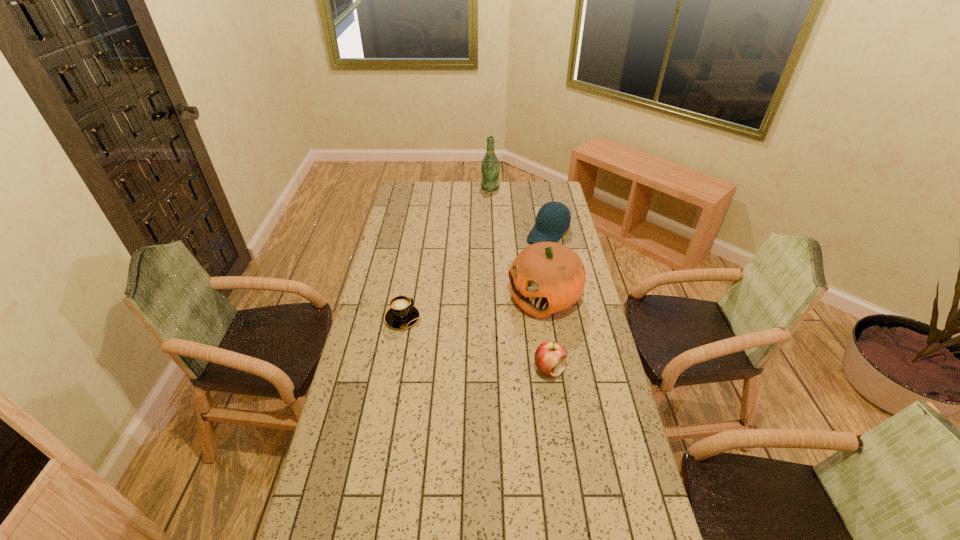
Find the location of a particular element. The width and height of the screenshot is (960, 540). object situated at the far edge is located at coordinates (490, 168).

Where is `object located in the left edge section of the desktop`? This screenshot has width=960, height=540. object located in the left edge section of the desktop is located at coordinates tap(402, 314).

Find the location of a particular element. The image size is (960, 540). apple present at the right edge is located at coordinates (550, 357).

Where is `pumpkin that is at the right edge`? The width and height of the screenshot is (960, 540). pumpkin that is at the right edge is located at coordinates (546, 277).

This screenshot has height=540, width=960. I want to click on baseball cap that is positioned at the right edge, so pos(553,219).

This screenshot has width=960, height=540. I want to click on free space at the far edge of the desktop, so click(533, 199).

Where is `blank space at the left edge`? The width and height of the screenshot is (960, 540). blank space at the left edge is located at coordinates (353, 434).

This screenshot has width=960, height=540. In the image, there is a desktop. Find the location of `vacant space at the right edge`. vacant space at the right edge is located at coordinates (566, 384).

Where is `free location at the far left corner`? free location at the far left corner is located at coordinates (422, 201).

Find the location of `free space that is in between the shortest object and the pumpkin`. free space that is in between the shortest object and the pumpkin is located at coordinates (474, 308).